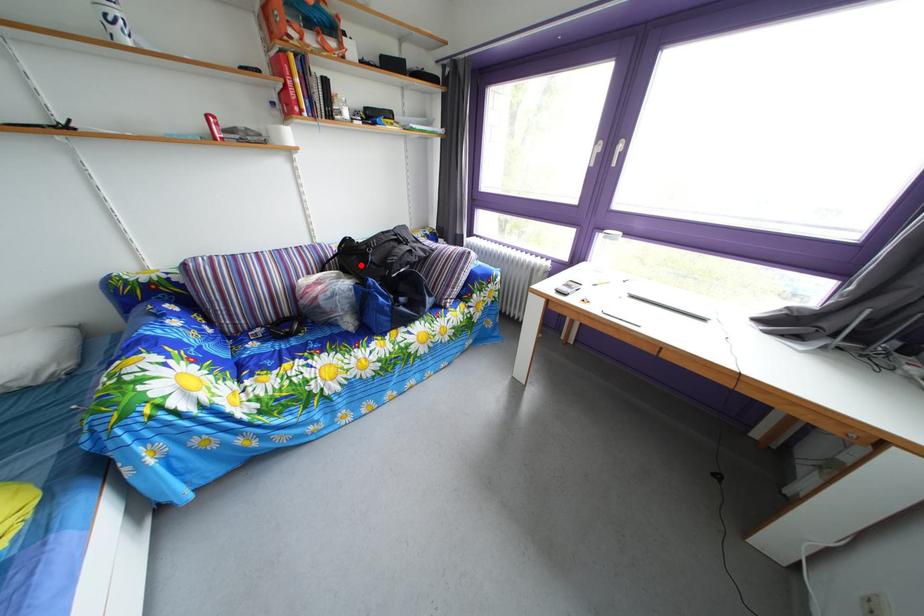
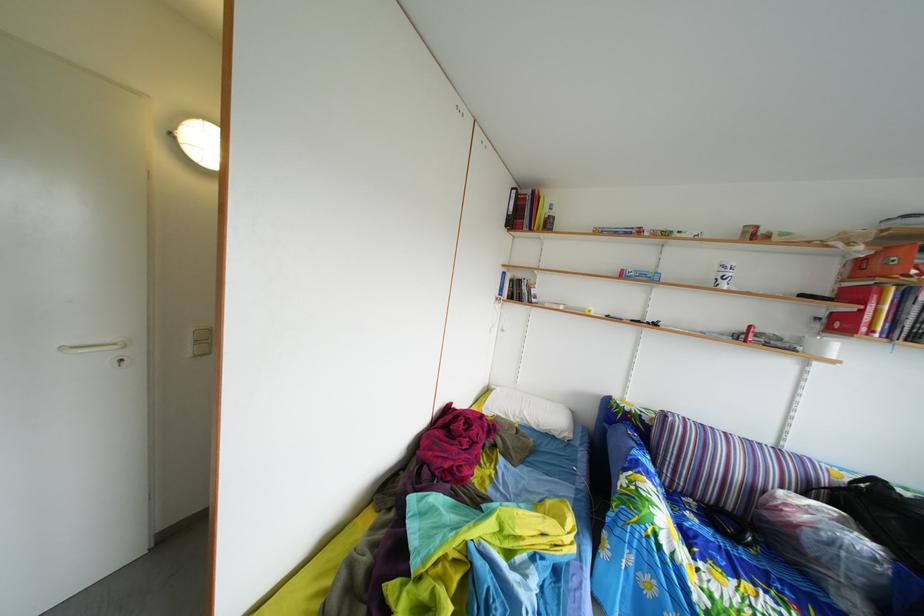
The point at the highlighted location is marked in the first image. Where is the corresponding point in the second image?

(886, 515)